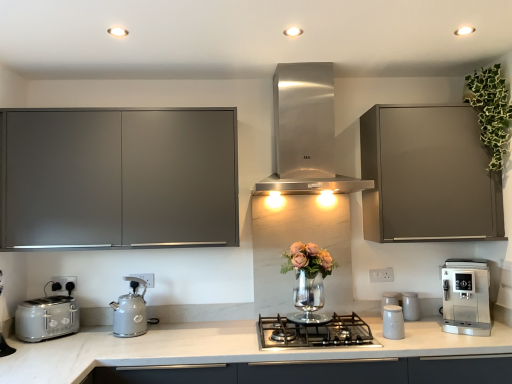
Question: From the image's perspective, is white plastic electric outlet at lower right, placed as the first electric outlet when sorted from front to back, beneath stainless steel range hood at center, which appears as the second home appliance when viewed from the right?

Choices:
 (A) no
 (B) yes

Answer: (B)

Question: Can you confirm if white plastic electric outlet at lower right, arranged as the third electric outlet when viewed from the left, is positioned to the left of stainless steel range hood at center, acting as the 1th home appliance starting from the left?

Choices:
 (A) yes
 (B) no

Answer: (B)

Question: From a real-world perspective, is white plastic electric outlet at lower right, placed as the first electric outlet when sorted from front to back, located beneath stainless steel range hood at center, acting as the 1th home appliance starting from the left?

Choices:
 (A) no
 (B) yes

Answer: (B)

Question: Can you confirm if white plastic electric outlet at lower right, placed as the first electric outlet when sorted from front to back, is bigger than stainless steel range hood at center, which is counted as the 2th home appliance, starting from the bottom?

Choices:
 (A) yes
 (B) no

Answer: (B)

Question: Does white plastic electric outlet at lower right, arranged as the third electric outlet when viewed from the left, appear on the right side of stainless steel range hood at center, which appears as the second home appliance when viewed from the right?

Choices:
 (A) yes
 (B) no

Answer: (A)

Question: From a real-world perspective, is white plastic electric outlet at lower right, the first electric outlet in the right-to-left sequence, located higher than stainless steel range hood at center, which is counted as the 2th home appliance, starting from the bottom?

Choices:
 (A) yes
 (B) no

Answer: (B)

Question: Can you confirm if white glossy canisters at center-right, which is the 3th kitchen appliance in left-to-right order, is bigger than matte gray cabinet at upper right, acting as the 1th cabinetry starting from the right?

Choices:
 (A) no
 (B) yes

Answer: (A)

Question: Can you confirm if white glossy canisters at center-right, arranged as the second kitchen appliance when viewed from the right, is shorter than matte gray cabinet at upper right, acting as the 1th cabinetry starting from the right?

Choices:
 (A) yes
 (B) no

Answer: (A)

Question: Is white glossy canisters at center-right, which is the 3th kitchen appliance from front to back, looking in the opposite direction of matte gray cabinet at upper right, which ranks as the second cabinetry in left-to-right order?

Choices:
 (A) no
 (B) yes

Answer: (A)

Question: Is white glossy canisters at center-right, which is the 3th kitchen appliance from front to back, to the right of matte gray cabinet at upper right, which ranks as the second cabinetry in left-to-right order, from the viewer's perspective?

Choices:
 (A) no
 (B) yes

Answer: (A)

Question: Is white glossy canisters at center-right, which is the 3th kitchen appliance in left-to-right order, to the left of matte gray cabinet at upper right, acting as the 1th cabinetry starting from the right, from the viewer's perspective?

Choices:
 (A) no
 (B) yes

Answer: (B)

Question: From the image's perspective, is white glossy canisters at center-right, arranged as the second kitchen appliance when viewed from the right, below matte gray cabinet at upper right, acting as the 1th cabinetry starting from the right?

Choices:
 (A) no
 (B) yes

Answer: (B)

Question: Is stainless steel gas stove at center surrounding white plastic electric outlet at lower center, the second electric outlet viewed from the back?

Choices:
 (A) no
 (B) yes

Answer: (A)